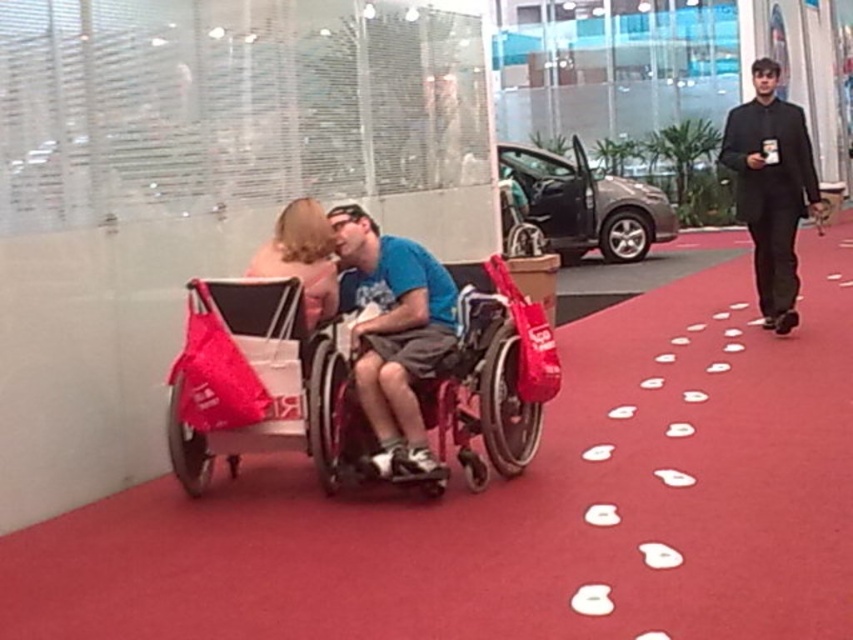
Does black suit at right have a smaller size compared to blonde hair at center?

No.

This screenshot has width=853, height=640. What are the coordinates of `black suit at right` in the screenshot? It's located at (770, 188).

Is blue matte shirt at center above black suit at right?

Incorrect, blue matte shirt at center is not positioned above black suit at right.

Between blue matte shirt at center and black suit at right, which one has less height?

blue matte shirt at center is shorter.

What do you see at coordinates (395, 336) in the screenshot?
I see `blue matte shirt at center` at bounding box center [395, 336].

This screenshot has height=640, width=853. In order to click on blue matte shirt at center in this screenshot , I will do `click(395, 336)`.

Can you confirm if metallic wheelchair at center is taller than black suit at right?

No, metallic wheelchair at center is not taller than black suit at right.

Does metallic wheelchair at center lie in front of black suit at right?

Yes, metallic wheelchair at center is closer to the viewer.

The width and height of the screenshot is (853, 640). In order to click on metallic wheelchair at center in this screenshot , I will do `click(492, 378)`.